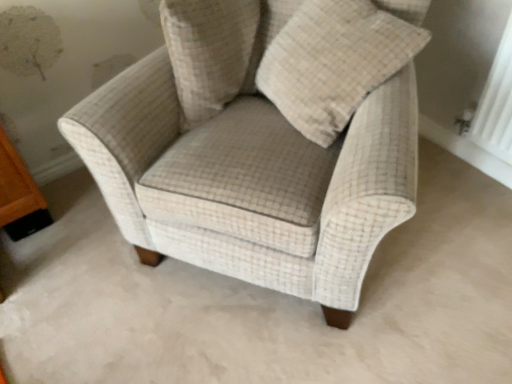
Question: Is beige checkered armchair at center oriented towards beige checkered pillow at center?

Choices:
 (A) no
 (B) yes

Answer: (B)

Question: Is beige checkered armchair at center turned away from beige checkered pillow at center?

Choices:
 (A) yes
 (B) no

Answer: (A)

Question: Is beige checkered armchair at center in front of beige checkered pillow at center?

Choices:
 (A) no
 (B) yes

Answer: (B)

Question: Is beige checkered armchair at center positioned beyond the bounds of beige checkered pillow at center?

Choices:
 (A) no
 (B) yes

Answer: (B)

Question: Can you confirm if beige checkered armchair at center is positioned to the right of beige checkered pillow at center?

Choices:
 (A) yes
 (B) no

Answer: (B)

Question: Can you confirm if beige checkered armchair at center is positioned to the left of beige checkered pillow at center?

Choices:
 (A) yes
 (B) no

Answer: (A)

Question: Is beige checkered armchair at center completely or partially inside beige checkered pillow at upper center?

Choices:
 (A) yes
 (B) no

Answer: (B)

Question: Does beige checkered pillow at upper center have a smaller size compared to beige checkered armchair at center?

Choices:
 (A) yes
 (B) no

Answer: (A)

Question: Does beige checkered pillow at upper center appear on the right side of beige checkered armchair at center?

Choices:
 (A) yes
 (B) no

Answer: (B)

Question: Does beige checkered pillow at upper center have a lesser height compared to beige checkered armchair at center?

Choices:
 (A) no
 (B) yes

Answer: (B)

Question: Considering the relative sizes of beige checkered pillow at upper center and beige checkered armchair at center in the image provided, is beige checkered pillow at upper center thinner than beige checkered armchair at center?

Choices:
 (A) no
 (B) yes

Answer: (B)

Question: Is beige checkered pillow at upper center not inside beige checkered armchair at center?

Choices:
 (A) no
 (B) yes

Answer: (A)

Question: From the image's perspective, would you say beige checkered armchair at center is positioned over beige checkered pillow at upper center?

Choices:
 (A) no
 (B) yes

Answer: (A)